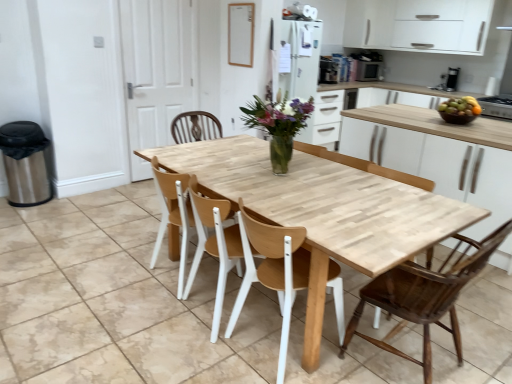
Question: Are shiny brown bowl at right and matte black microwave at upper right, which is the 3th appliance in bottom-to-top order, beside each other?

Choices:
 (A) yes
 (B) no

Answer: (B)

Question: Is shiny brown bowl at right oriented towards matte black microwave at upper right, the 1th appliance positioned from the back?

Choices:
 (A) yes
 (B) no

Answer: (B)

Question: Considering the relative sizes of shiny brown bowl at right and matte black microwave at upper right, the second appliance from the left, in the image provided, is shiny brown bowl at right taller than matte black microwave at upper right, the second appliance from the left,?

Choices:
 (A) no
 (B) yes

Answer: (A)

Question: Is matte black microwave at upper right, the second appliance from the right, surrounded by shiny brown bowl at right?

Choices:
 (A) yes
 (B) no

Answer: (B)

Question: Is shiny brown bowl at right shorter than matte black microwave at upper right, the 1th appliance from the top?

Choices:
 (A) yes
 (B) no

Answer: (A)

Question: From the image's perspective, is shiny brown bowl at right on top of matte black microwave at upper right, the second appliance from the right?

Choices:
 (A) yes
 (B) no

Answer: (B)

Question: Is matte black microwave at upper right, which is the 3th appliance in bottom-to-top order, far away from light wood table at center?

Choices:
 (A) no
 (B) yes

Answer: (B)

Question: Is matte black microwave at upper right, the second appliance from the right, thinner than light wood table at center?

Choices:
 (A) yes
 (B) no

Answer: (A)

Question: Can you confirm if matte black microwave at upper right, the 1th appliance from the top, is taller than light wood table at center?

Choices:
 (A) no
 (B) yes

Answer: (A)

Question: Is matte black microwave at upper right, the 1th appliance from the top, touching light wood table at center?

Choices:
 (A) no
 (B) yes

Answer: (A)

Question: Is matte black microwave at upper right, which is the 3th appliance in bottom-to-top order, to the right of light wood table at center from the viewer's perspective?

Choices:
 (A) no
 (B) yes

Answer: (B)

Question: From a real-world perspective, is matte black microwave at upper right, the second appliance from the right, located higher than light wood table at center?

Choices:
 (A) yes
 (B) no

Answer: (A)

Question: Is metallic silver toaster at upper center, the second appliance in the bottom-to-top sequence, located within white matte cabinet at upper right?

Choices:
 (A) yes
 (B) no

Answer: (B)